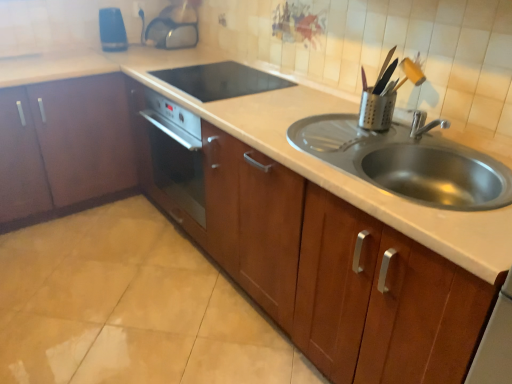
Where is `free space above wooden cabinet at center, the 2th cabinetry positioned from the left (from a real-world perspective)`? This screenshot has width=512, height=384. free space above wooden cabinet at center, the 2th cabinetry positioned from the left (from a real-world perspective) is located at coordinates (278, 105).